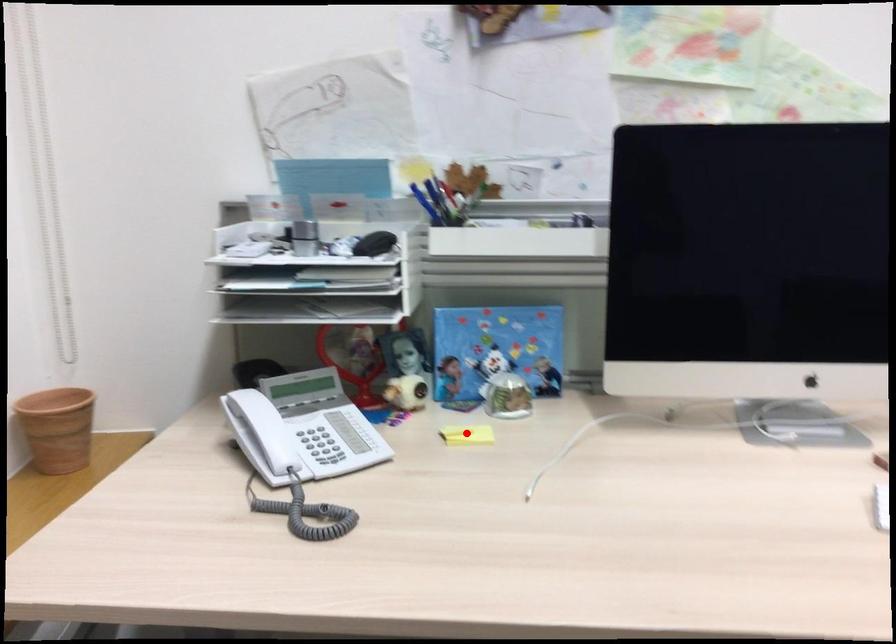
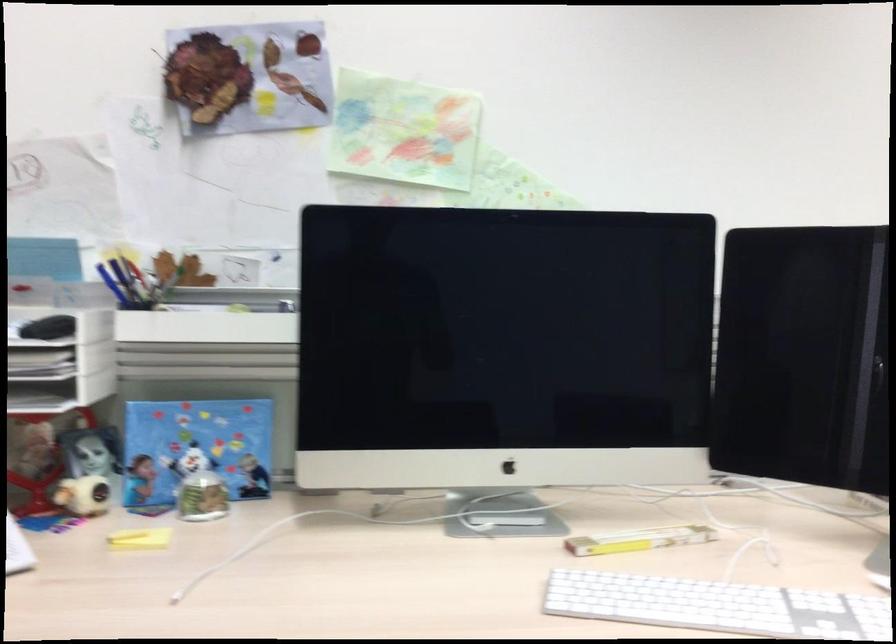
Question: I am providing you with two images of the same scene from different viewpoints. Given a red point in image1, look at the same physical point in image2. Is it:

Choices:
 (A) Closer to the viewpoint
 (B) Farther from the viewpoint

Answer: (A)